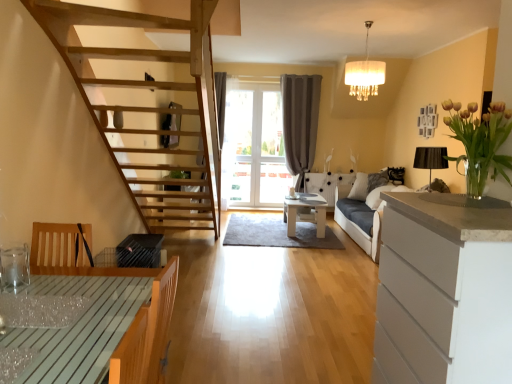
Question: Considering their positions, is transparent glass table at lower left located in front of or behind dark gray fabric couch at right?

Choices:
 (A) front
 (B) behind

Answer: (A)

Question: Based on their sizes in the image, would you say transparent glass table at lower left is bigger or smaller than dark gray fabric couch at right?

Choices:
 (A) big
 (B) small

Answer: (B)

Question: Which is farther from the white matte cabinet at right?

Choices:
 (A) wooden table at lower left, arranged as the 2th table when viewed from the back
 (B) white glossy table at center, the 1th table viewed from the back
 (C) gray fabric curtain at center
 (D) transparent glass table at lower left
 (E) dark gray fabric couch at right

Answer: (C)

Question: Considering the real-world distances, which object is farthest from the translucent glass vase at upper right?

Choices:
 (A) white fabric lampshade at upper center
 (B) white matte cabinet at right
 (C) dark gray fabric couch at right
 (D) gray fabric curtain at center
 (E) wooden table at lower left, which is the 2th table in right-to-left order

Answer: (D)